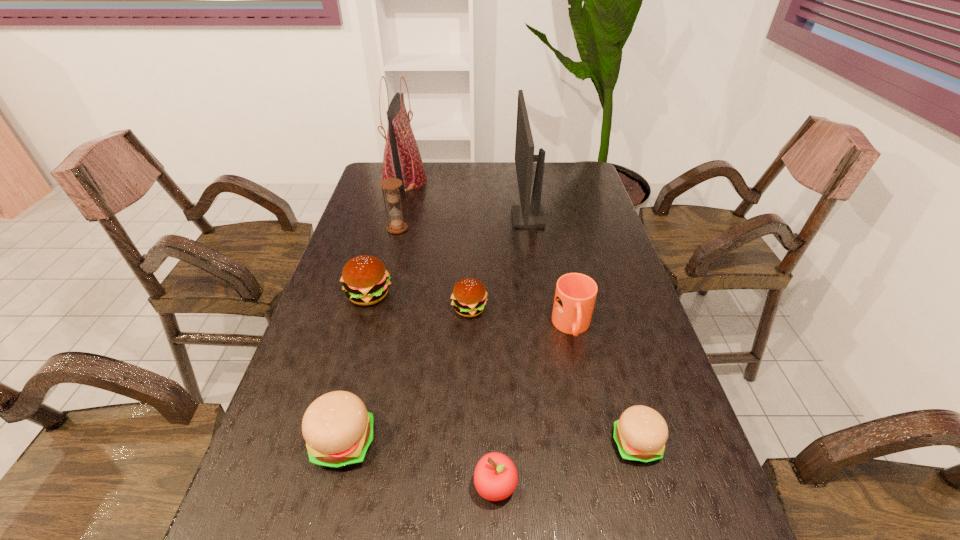
You are a GUI agent. You are given a task and a screenshot of the screen. Output one action in this format:
    pyautogui.click(x=<x>, y=<y>)
    Task: Click on the free space between the apple and the computer monitor
    The height and width of the screenshot is (540, 960).
    Given the screenshot: What is the action you would take?
    pyautogui.click(x=512, y=352)

The width and height of the screenshot is (960, 540). Find the location of `object that is the eighth closest to the computer monitor`. object that is the eighth closest to the computer monitor is located at coordinates (495, 477).

Locate an element on the screen. This screenshot has width=960, height=540. object that is the fifth closest one to the third tallest object is located at coordinates (575, 295).

Identify the location of the closest hamburger to the brown hourglass. (365, 279).

Identify which hamburger is the closest to the orange mug. Please provide its 2D coordinates. Your answer should be formatted as a tuple, i.e. [(x, y)], where the tuple contains the x and y coordinates of a point satisfying the conditions above.

[(469, 296)]

Identify the location of free spot that satisfies the following two spatial constraints: 1. on the front-facing side of the computer monitor; 2. on the front side of the left brown hamburger. (540, 295).

Locate an element on the screen. blank space that satisfies the following two spatial constraints: 1. on the back side of the red apple; 2. on the right side of the smaller beige hamburger is located at coordinates (494, 444).

Locate an element on the screen. The image size is (960, 540). vacant region that satisfies the following two spatial constraints: 1. on the handle side of the rightmost hamburger; 2. on the right side of the mug is located at coordinates (597, 444).

This screenshot has width=960, height=540. I want to click on free space that satisfies the following two spatial constraints: 1. on the front-facing side of the computer monitor; 2. on the right side of the rightmost hamburger, so click(x=562, y=444).